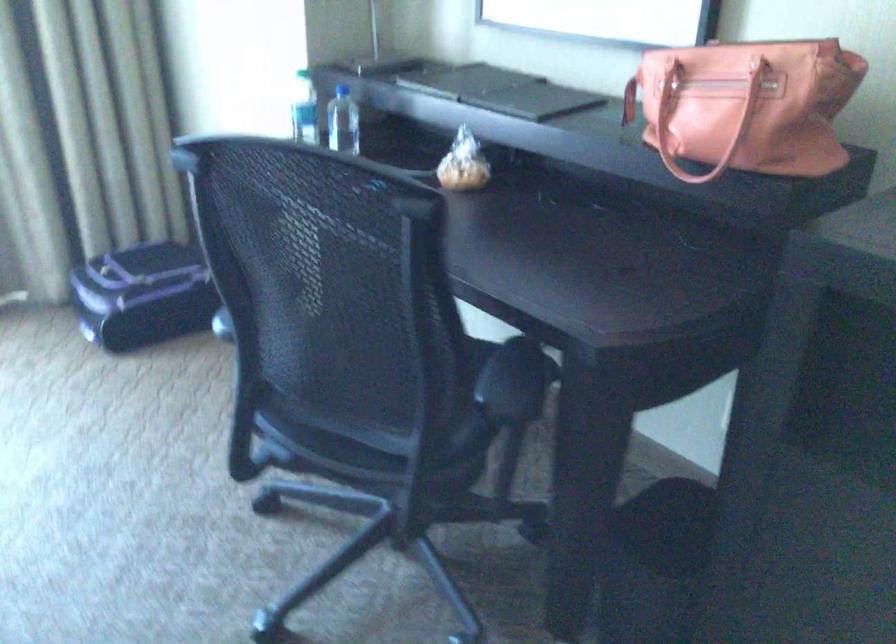
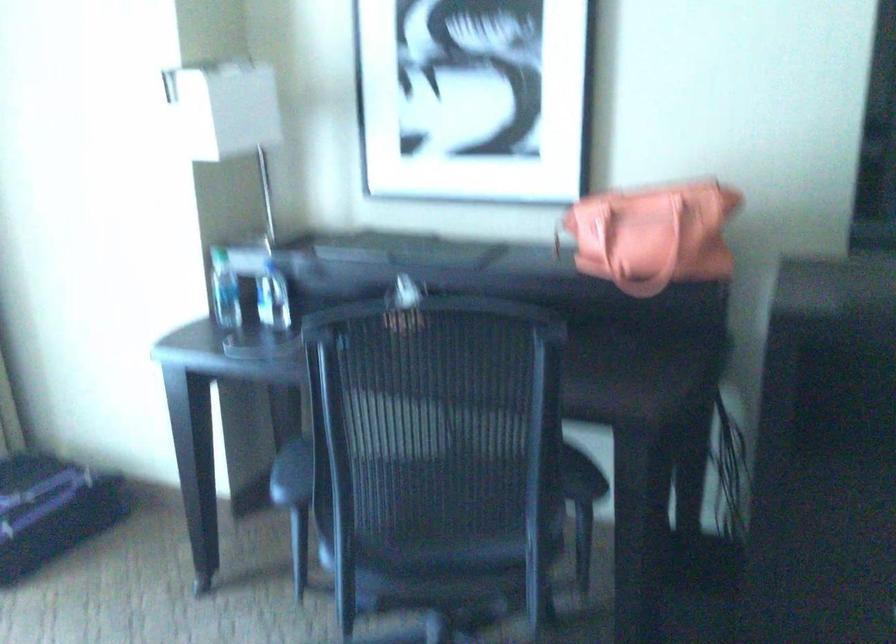
Locate, in the second image, the point that corresponds to (x=236, y=307) in the first image.

(291, 474)